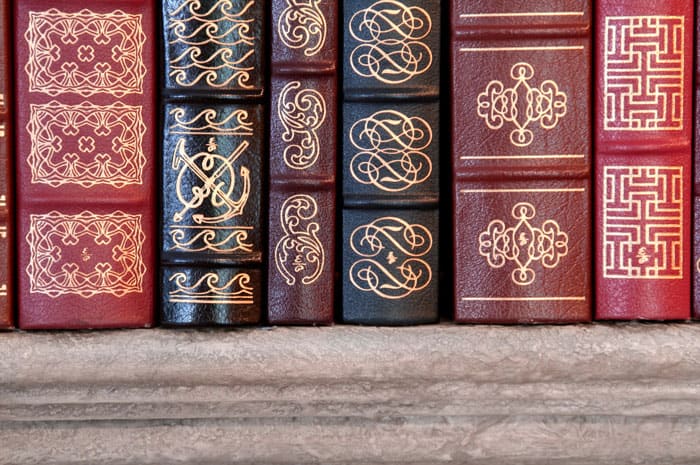
The width and height of the screenshot is (700, 465). Find the location of `books`. books is located at coordinates (0, 170), (62, 171), (214, 176), (294, 196), (411, 209), (522, 214), (665, 244).